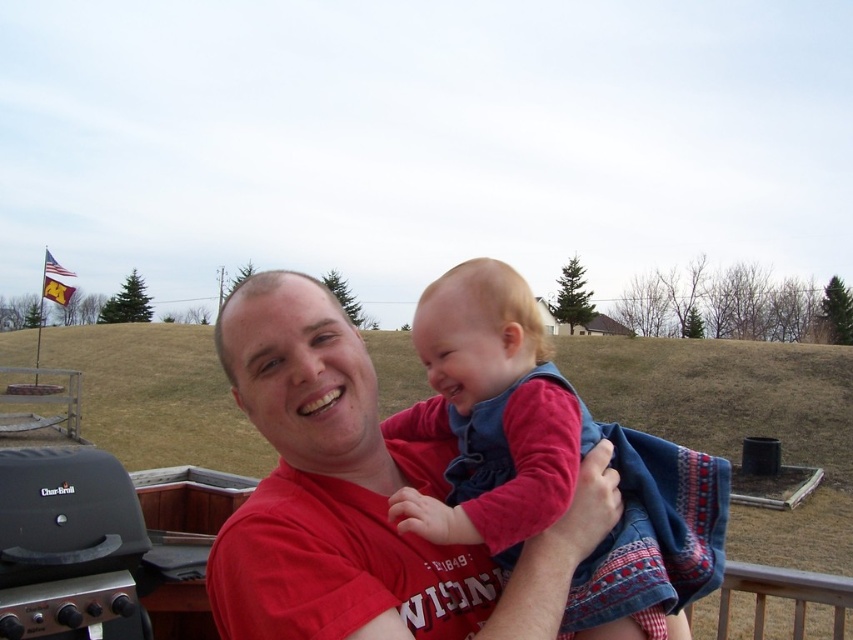
You are a photographer trying to capture the velvety blue dress at center and the black matte grill at lower left. Which object should you focus on first if you want to ensure both are in focus without moving the camera?

The velvety blue dress at center is in front of the black matte grill at lower left. To ensure both are in focus, you should focus on the black matte grill at lower left first since it is farther away, allowing the depth of field to cover the closer velvety blue dress at center.

Consider the image. You are a photographer trying to capture a candid shot of the velvety blue dress at center. You are standing 1.5 meters away from the dress. Is your current position sufficient to get a clear shot without moving closer?

The photographer is 1.5 meters away from the velvety blue dress at center, which is slightly farther than the 1.40 meters distance between them. This distance should still allow for a clear shot, but moving closer to around 1.40 meters might improve clarity and detail.

You are an observer standing in front of the image. You see the velvety blue dress at center and the black matte grill at lower left. Which object is positioned higher in the image?

The velvety blue dress at center is located above the black matte grill at lower left, so it is positioned higher in the image.